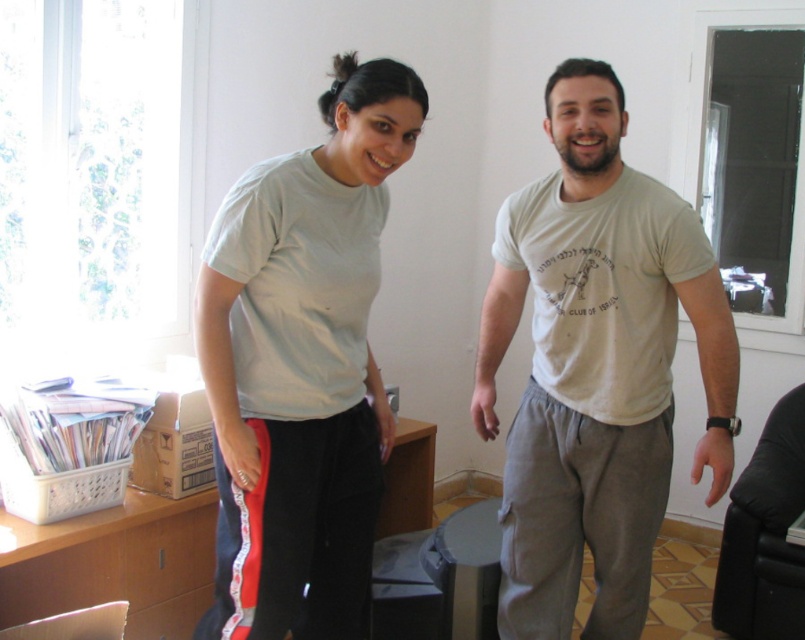
You are standing in the room and want to place a small plant between the two points marked as point (570, 365) and point (354, 381). Which point should the plant be closer to if it needs to be placed in front of the second point?

The plant should be placed closer to point (354, 381) because point (570, 365) is behind point (354, 381), so placing it near the front point would ensure it is in front of the second point.